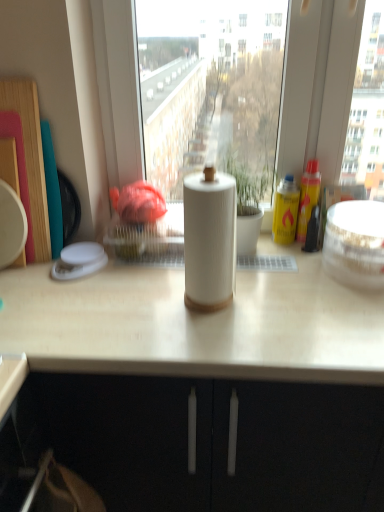
Identify the location of unoccupied area behind white matte paper towel at center. The width and height of the screenshot is (384, 512). pos(182,271).